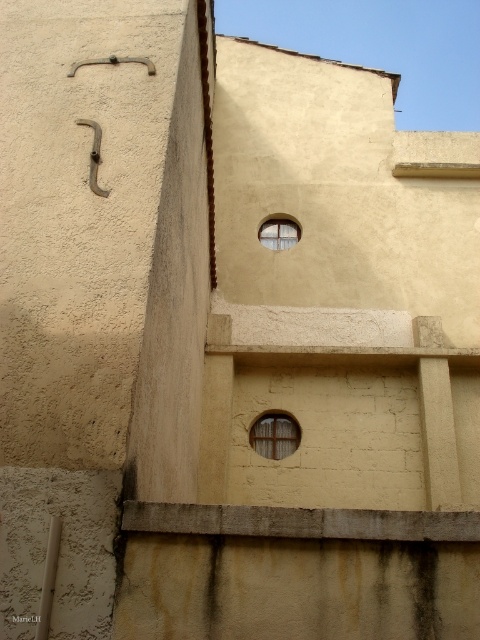
Which is behind, point (272, 433) or point (288, 237)?

Point (288, 237)

Is wooden at center positioned at the back of clear glass window at upper center?

No, wooden at center is in front of clear glass window at upper center.

At what (x,y) coordinates should I click in order to perform the action: click on wooden at center. Please return your answer as a coordinate pair (x, y). Looking at the image, I should click on (275, 435).